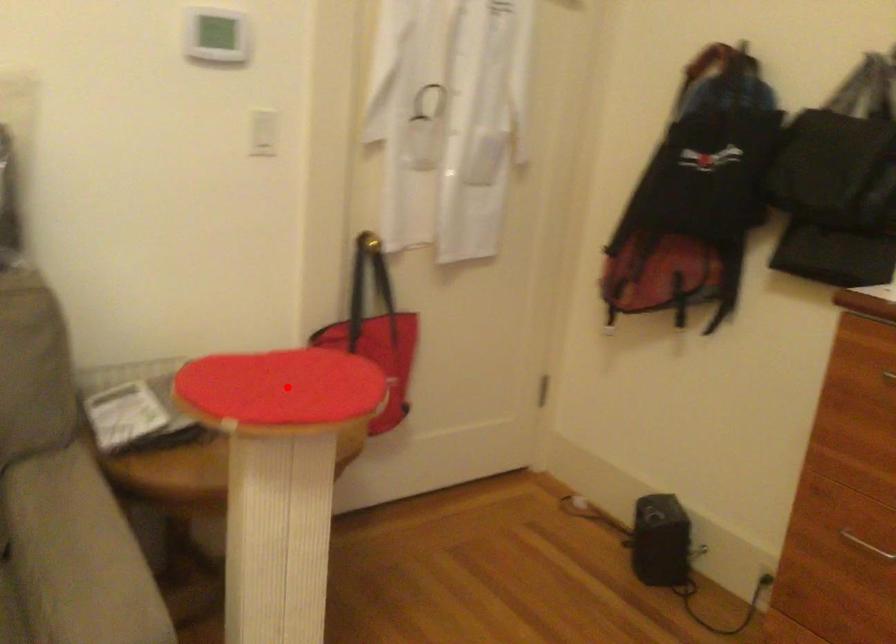
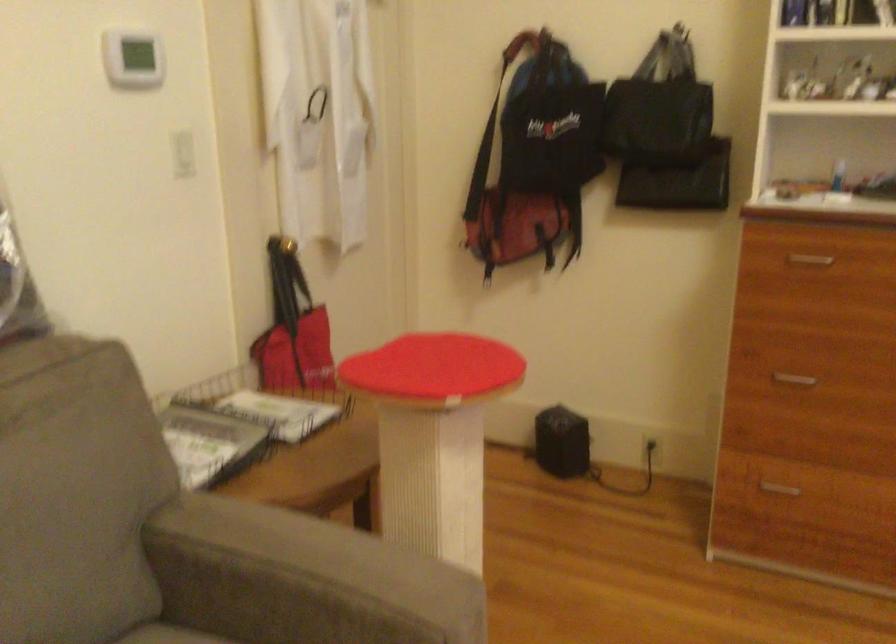
Find the pixel in the second image that matches the highlighted location in the first image.

(434, 366)